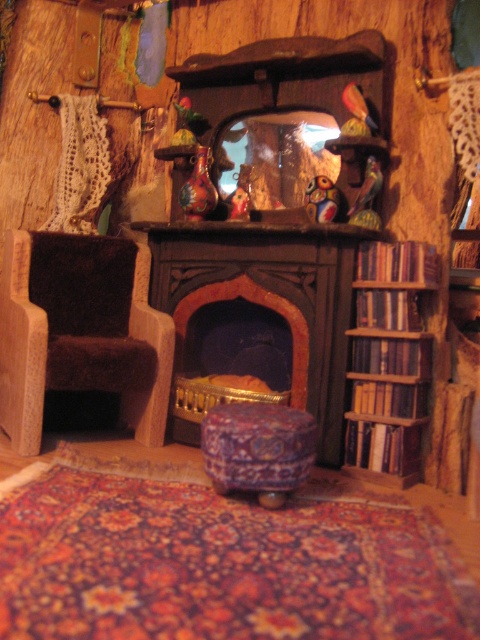
Question: Among these objects, which one is farthest from the camera?

Choices:
 (A) dark wood fireplace at center
 (B) carpeted fabric stool at center

Answer: (A)

Question: From the image, what is the correct spatial relationship of dark wood fireplace at center in relation to brown fuzzy armchair at left?

Choices:
 (A) below
 (B) above

Answer: (B)

Question: Does brown fuzzy armchair at left have a larger size compared to carpeted fabric stool at center?

Choices:
 (A) no
 (B) yes

Answer: (B)

Question: Which point is farther to the camera?

Choices:
 (A) (69, 362)
 (B) (253, 467)
 (C) (275, 388)
 (D) (412, 456)

Answer: (C)

Question: In this image, where is brown fuzzy armchair at left located relative to carpeted fabric stool at center?

Choices:
 (A) above
 (B) below

Answer: (A)

Question: Estimate the real-world distances between objects in this image. Which object is closer to the wooden bookshelf at right?

Choices:
 (A) brown fuzzy armchair at left
 (B) carpeted fabric stool at center
 (C) dark wood fireplace at center

Answer: (C)